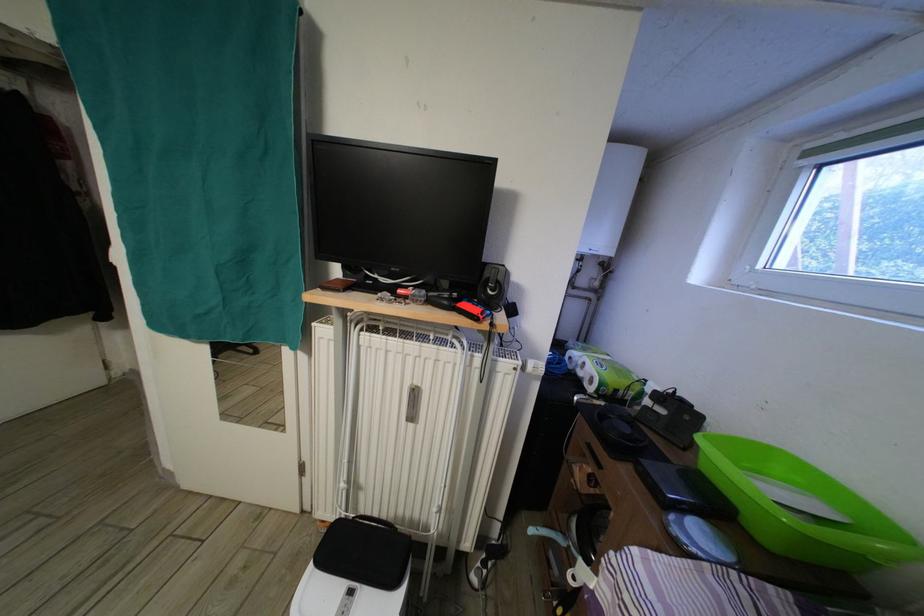
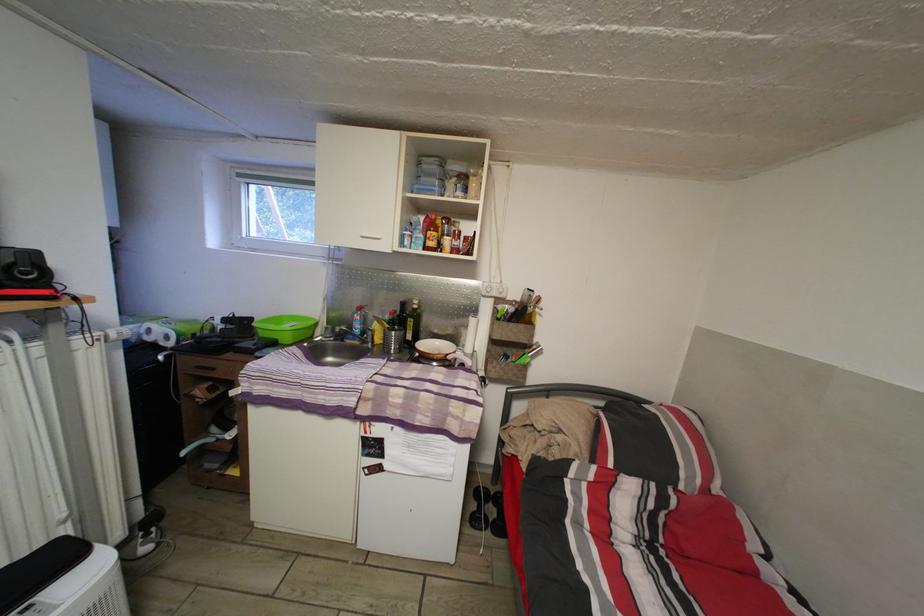
Locate, in the second image, the point that corresponds to (759,277) in the first image.

(249, 244)